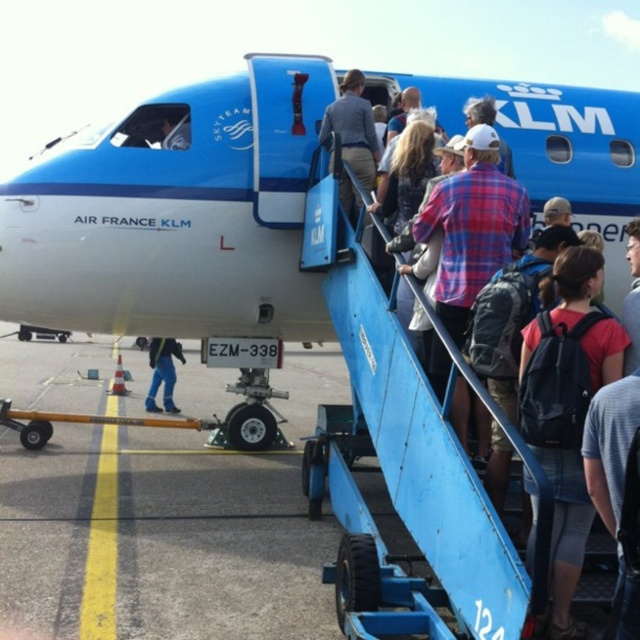
Question: Considering the real-world distances, which object is farthest from the matte blue backpack at center-right?

Choices:
 (A) light gray fabric jacket at upper center
 (B) blue matte airplane at center

Answer: (B)

Question: Does blue matte airplane at center appear under matte blue backpack at center-right?

Choices:
 (A) no
 (B) yes

Answer: (A)

Question: From the image, what is the correct spatial relationship of light gray fabric jacket at upper center in relation to dark blue jeans at lower left?

Choices:
 (A) below
 (B) above

Answer: (B)

Question: Which object is positioned closest to the light gray fabric jacket at upper center?

Choices:
 (A) dark blue jeans at lower left
 (B) matte blue backpack at center-right

Answer: (B)

Question: Which object appears farthest from the camera in this image?

Choices:
 (A) blue matte airplane at center
 (B) dark blue backpack at center
 (C) light gray fabric jacket at upper center
 (D) dark blue jeans at lower left

Answer: (D)

Question: Does blue matte airplane at center have a larger size compared to dark blue backpack at center?

Choices:
 (A) yes
 (B) no

Answer: (A)